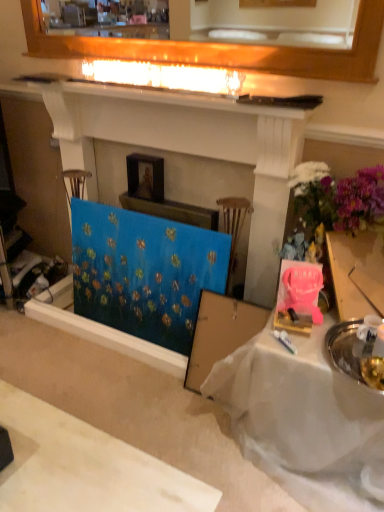
Locate an element on the screen. vacant area in front of blue fabric painting at center is located at coordinates (147, 399).